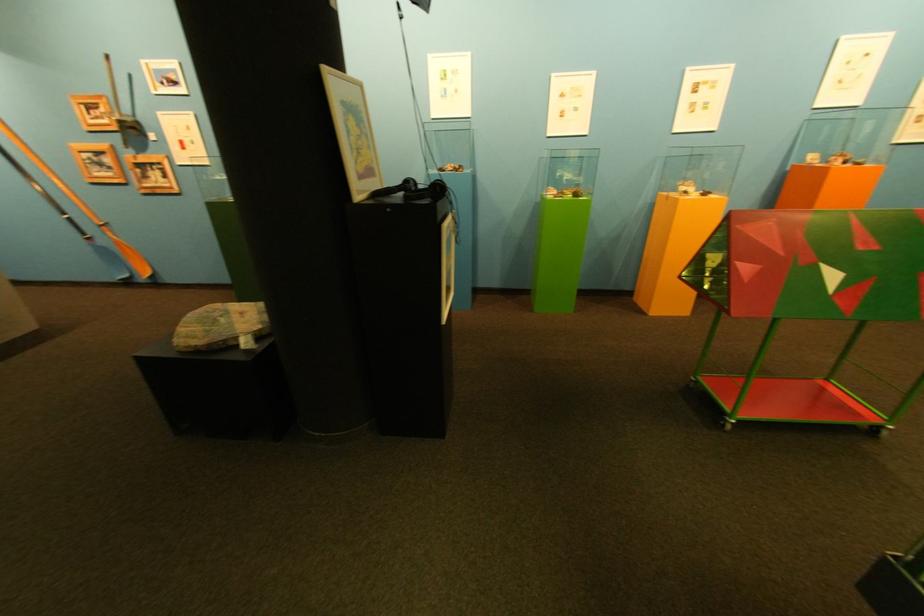
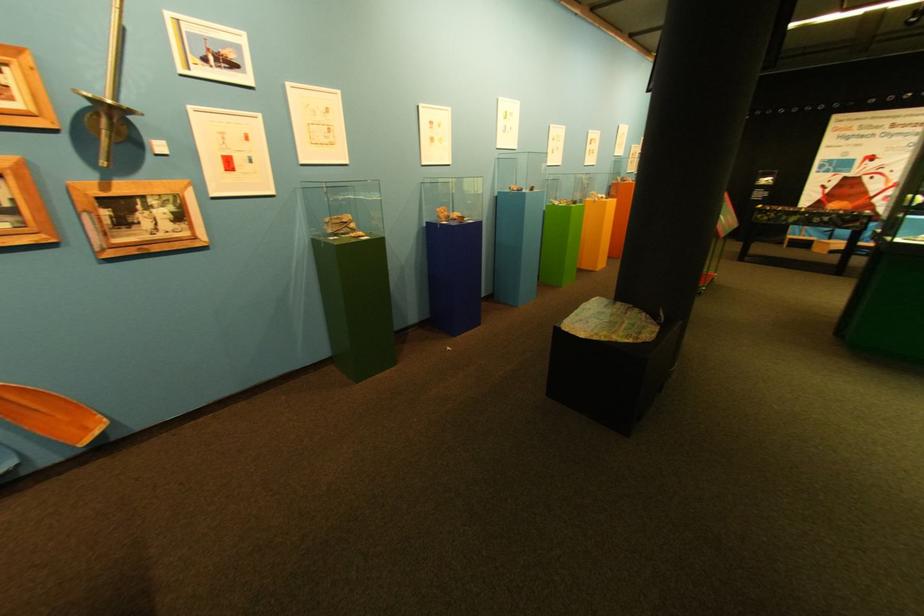
In the second image, find the point that corresponds to the point at 189,84 in the first image.

(248, 67)